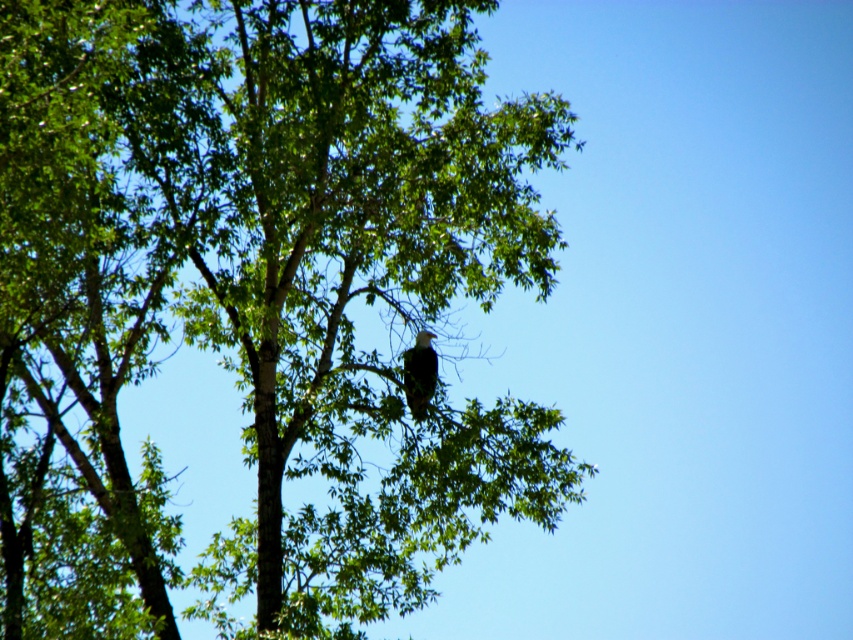
Question: Considering the relative positions of green leafy tree at center and white feathered eagle at center in the image provided, where is green leafy tree at center located with respect to white feathered eagle at center?

Choices:
 (A) above
 (B) below

Answer: (A)

Question: Which point is closer to the camera taking this photo?

Choices:
 (A) (80, 352)
 (B) (416, 404)

Answer: (B)

Question: Is green leafy tree at center positioned in front of white feathered eagle at center?

Choices:
 (A) yes
 (B) no

Answer: (A)

Question: Does green leafy tree at center have a lesser width compared to white feathered eagle at center?

Choices:
 (A) yes
 (B) no

Answer: (B)

Question: Which object is closer to the camera taking this photo?

Choices:
 (A) green leafy tree at center
 (B) white feathered eagle at center

Answer: (A)